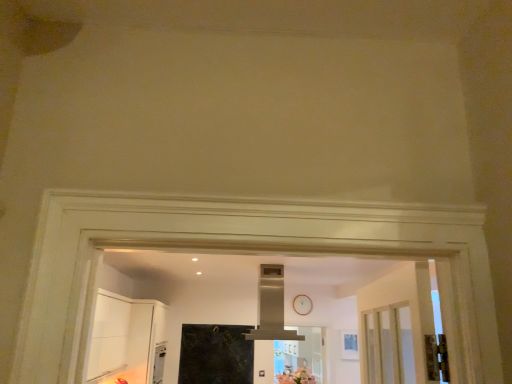
Question: Looking at the image, does pink matte flower at center seem bigger or smaller compared to satin silver exhaust hood at center?

Choices:
 (A) big
 (B) small

Answer: (B)

Question: Is pink matte flower at center in front of or behind satin silver exhaust hood at center in the image?

Choices:
 (A) front
 (B) behind

Answer: (B)

Question: Is pink matte flower at center to the left or to the right of satin silver exhaust hood at center in the image?

Choices:
 (A) right
 (B) left

Answer: (A)

Question: Would you say satin silver exhaust hood at center is to the left or to the right of pink matte flower at center in the picture?

Choices:
 (A) left
 (B) right

Answer: (A)

Question: Considering the positions of satin silver exhaust hood at center and pink matte flower at center in the image, is satin silver exhaust hood at center taller or shorter than pink matte flower at center?

Choices:
 (A) short
 (B) tall

Answer: (B)

Question: Based on their sizes in the image, would you say satin silver exhaust hood at center is bigger or smaller than pink matte flower at center?

Choices:
 (A) small
 (B) big

Answer: (B)

Question: From the image's perspective, is satin silver exhaust hood at center positioned above or below pink matte flower at center?

Choices:
 (A) above
 (B) below

Answer: (A)